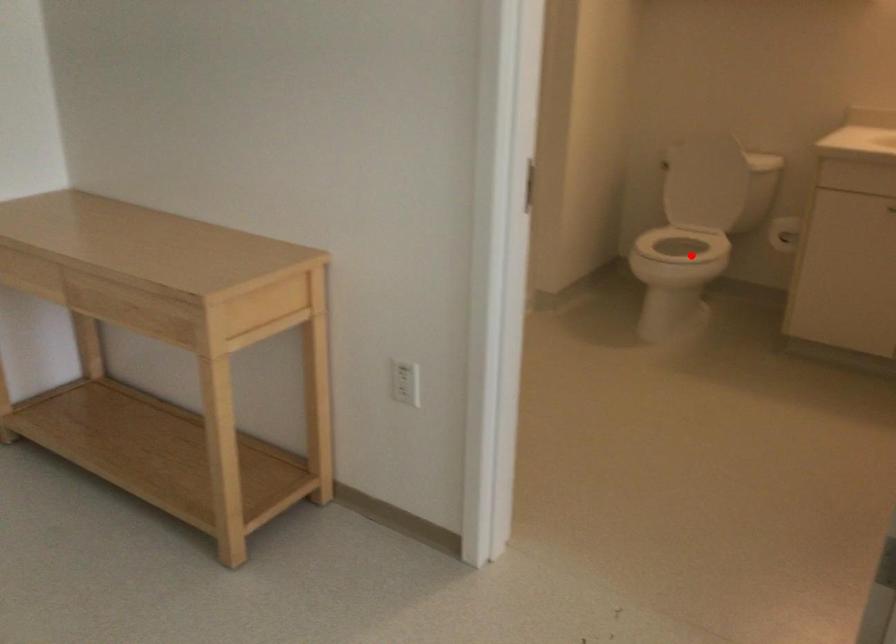
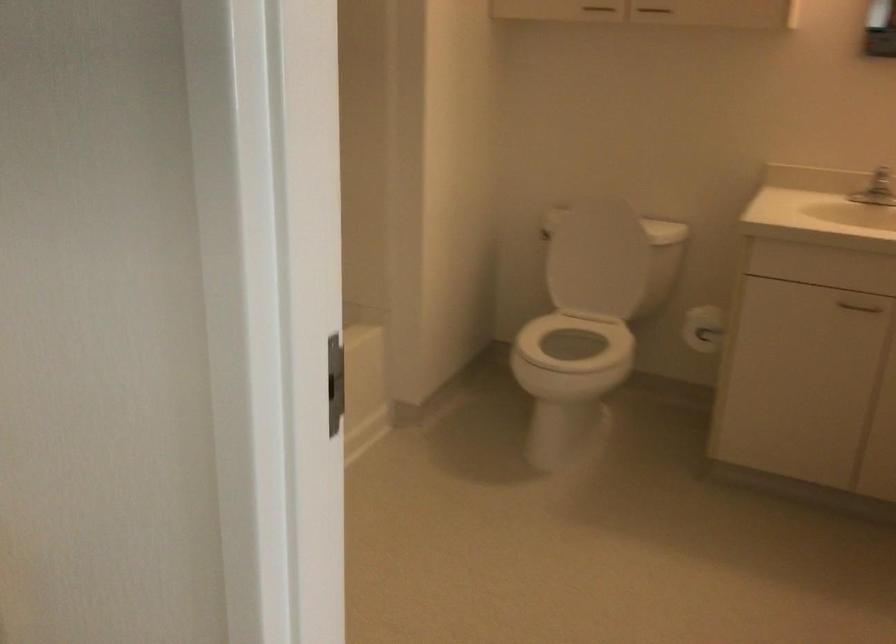
In the second image, find the point that corresponds to the highlighted location in the first image.

(571, 357)